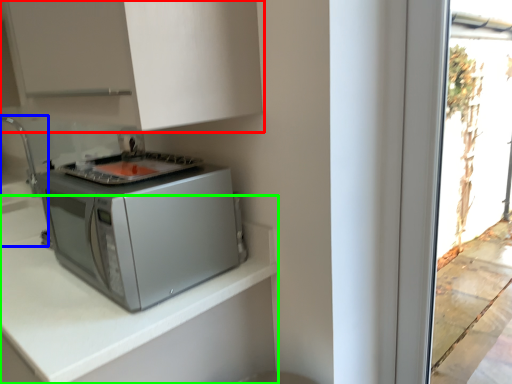
Question: Which object is the closest to the cabinetry (highlighted by a red box)? Choose among these: sink (highlighted by a blue box) or countertop (highlighted by a green box).

Choices:
 (A) sink
 (B) countertop

Answer: (B)